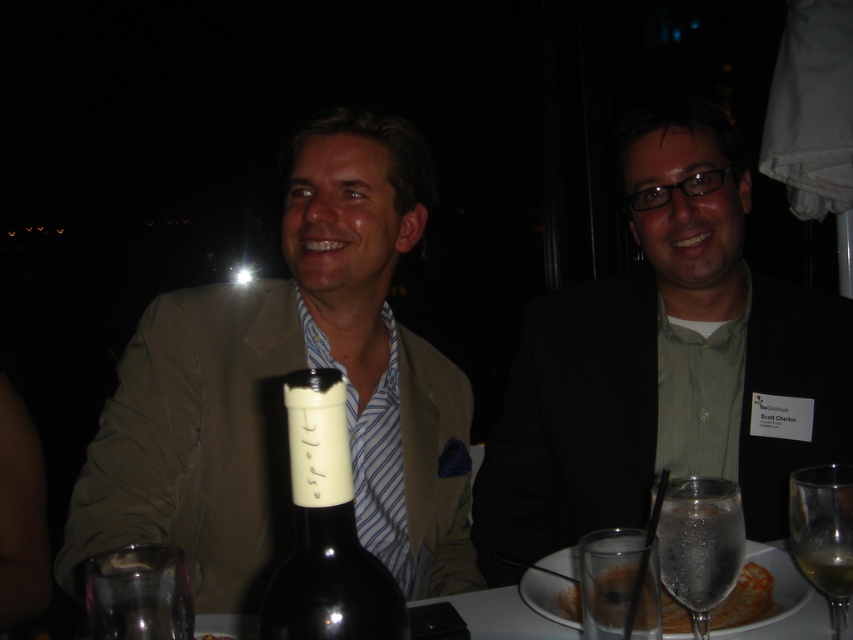
You are a photographer adjusting your camera settings to focus on two points in the image. The points are labeled as point (698, 618) and point (764, 605). Which point should you focus on first if you want to ensure the closer one is in sharp focus?

Point (698, 618) is closer to the camera than point (764, 605), so you should focus on point (698, 618) first to ensure it is in sharp focus.

You are a photographer setting up for a portrait shoot. You need to ensure that the light beige suit at center and the clear glass at lower right are both in focus. Given that your camera can only focus on objects within a 10 cm vertical range, can both items be in focus simultaneously?

The light beige suit at center is located above the clear glass at lower right. Since the vertical distance between them is not specified, but the camera can focus within a 10 cm range, it depends on their actual separation. However, based on typical portrait setups, they are likely within 10 cm, so yes, both can be in focus.